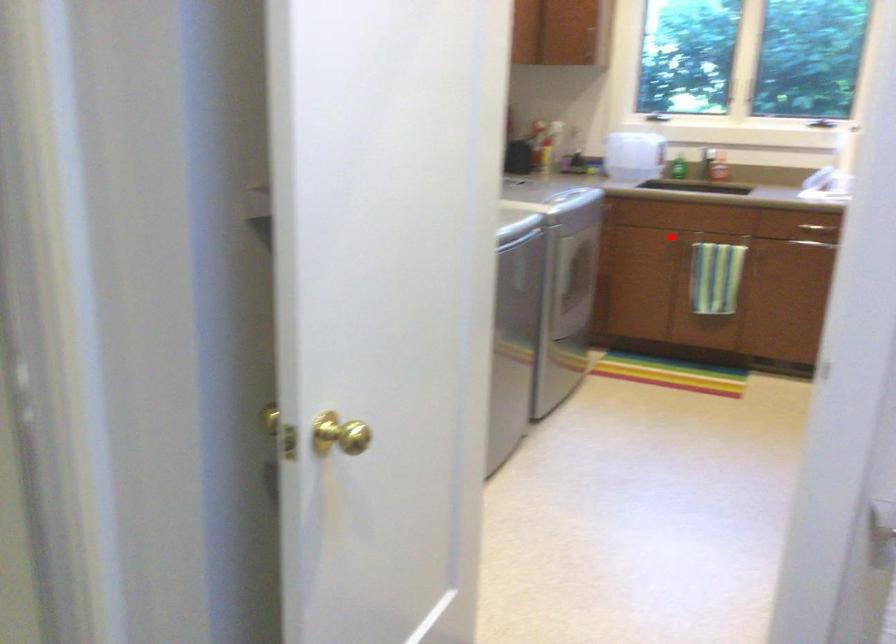
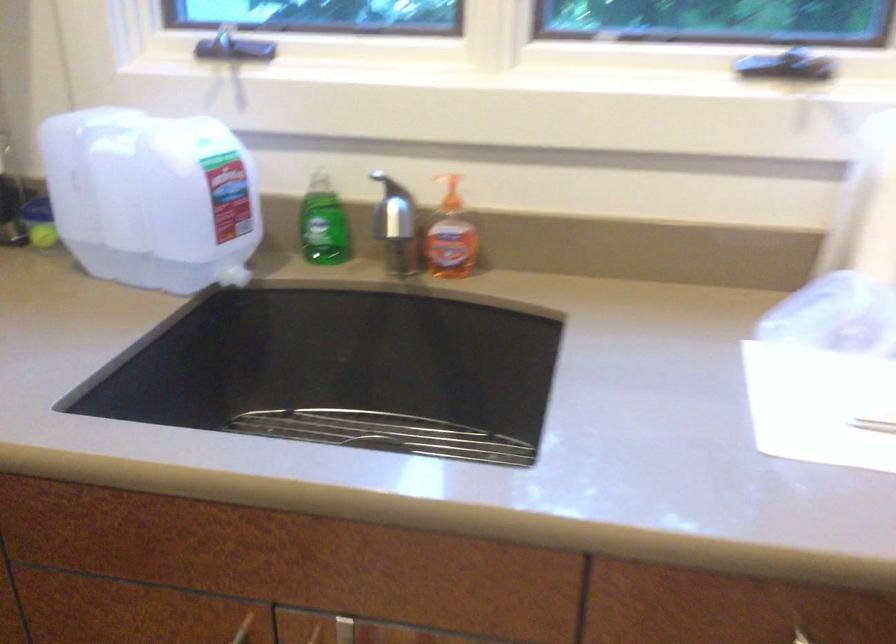
Find the pixel in the second image that matches the highlighted location in the first image.

(243, 629)